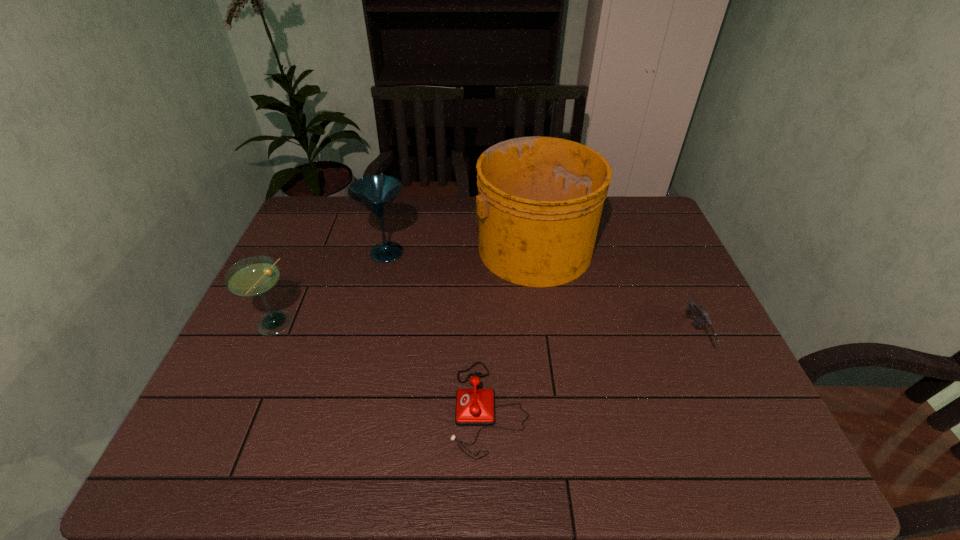
At what (x,y) coordinates should I click in order to perform the action: click on bucket. Please return your answer as a coordinate pair (x, y). The width and height of the screenshot is (960, 540). Looking at the image, I should click on (539, 203).

Find the location of a particular element. The width and height of the screenshot is (960, 540). the fourth object from right to left is located at coordinates (376, 193).

Identify the location of the fourth shortest object. (376, 193).

Locate an element on the screen. The width and height of the screenshot is (960, 540). the third tallest object is located at coordinates (255, 276).

Where is `the leftmost object`? The height and width of the screenshot is (540, 960). the leftmost object is located at coordinates (255, 276).

Find the location of a particular element. the second shortest object is located at coordinates (696, 310).

Image resolution: width=960 pixels, height=540 pixels. Identify the location of gun. [x=696, y=310].

Locate an element on the screen. the nearest object is located at coordinates (474, 407).

At what (x,y) coordinates should I click in order to perform the action: click on telephone. Please return your answer as a coordinate pair (x, y). Looking at the image, I should click on (474, 407).

Locate an element on the screen. The image size is (960, 540). blank space located 0.320m on the front of the bucket is located at coordinates (552, 386).